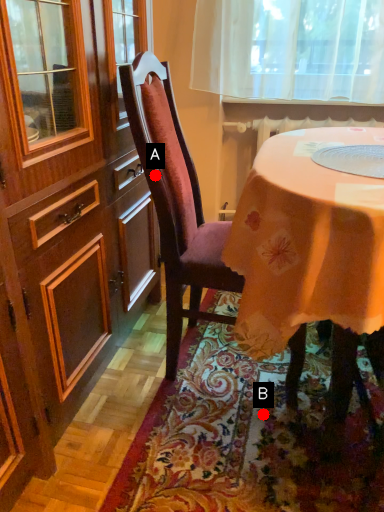
Question: Two points are circled on the image, labeled by A and B beside each circle. Which point appears farthest from the camera in this image?

Choices:
 (A) A is further
 (B) B is further

Answer: (B)